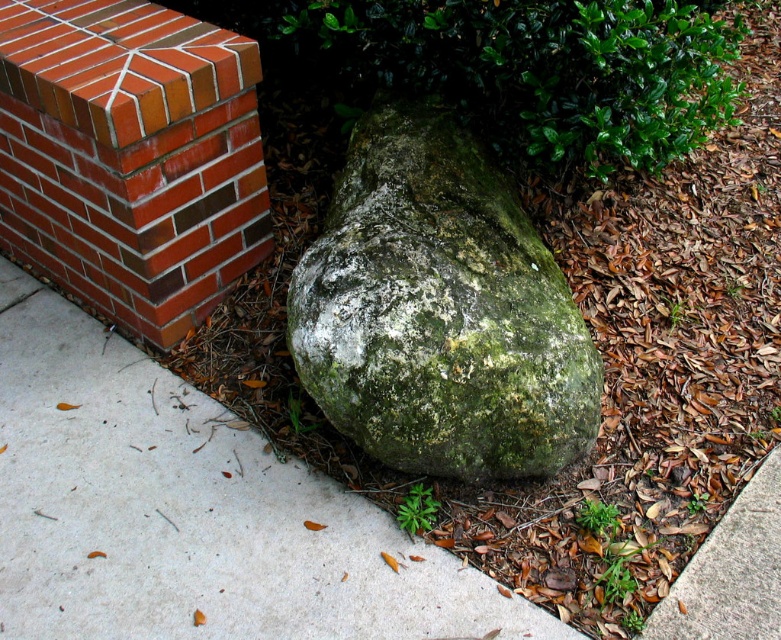
Question: Does gray concrete pavement at center appear on the left side of green mossy rock at center?

Choices:
 (A) yes
 (B) no

Answer: (A)

Question: Which object appears farthest from the camera in this image?

Choices:
 (A) gray concrete pavement at center
 (B) red brick at upper left
 (C) green mossy rock at center

Answer: (B)

Question: Is gray concrete pavement at center smaller than red brick at upper left?

Choices:
 (A) yes
 (B) no

Answer: (B)

Question: Which is farther from the red brick at upper left?

Choices:
 (A) green mossy rock at center
 (B) gray concrete pavement at center

Answer: (A)

Question: Based on their relative distances, which object is nearer to the gray concrete pavement at center?

Choices:
 (A) green mossy rock at center
 (B) red brick at upper left

Answer: (B)

Question: Can you confirm if gray concrete pavement at center is wider than red brick at upper left?

Choices:
 (A) no
 (B) yes

Answer: (B)